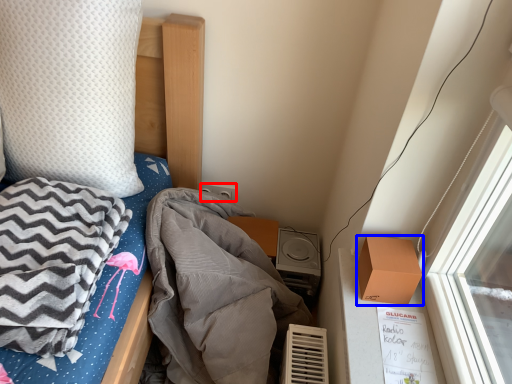
Question: Which point is closer to the camera, power plugs and sockets (highlighted by a red box) or box (highlighted by a blue box)?

Choices:
 (A) power plugs and sockets
 (B) box

Answer: (B)